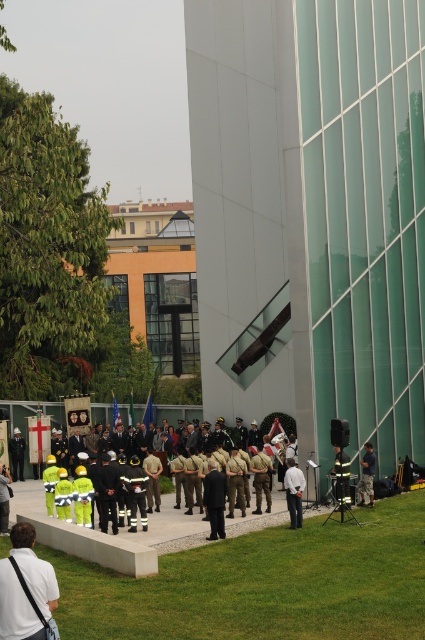
Question: Which point appears closest to the camera in this image?

Choices:
 (A) (346, 500)
 (B) (48, 612)

Answer: (B)

Question: Which object is closer to the camera taking this photo?

Choices:
 (A) white fabric uniform at lower left
 (B) reflective silver helmet at center

Answer: (A)

Question: Which of the following is the farthest from the observer?

Choices:
 (A) white fabric uniform at lower left
 (B) reflective silver helmet at center

Answer: (B)

Question: In this image, where is white fabric uniform at lower left located relative to reflective silver helmet at center?

Choices:
 (A) right
 (B) left

Answer: (B)

Question: Can you confirm if white fabric uniform at lower left is bigger than reflective silver helmet at center?

Choices:
 (A) no
 (B) yes

Answer: (A)

Question: Is white fabric uniform at lower left above reflective silver helmet at center?

Choices:
 (A) yes
 (B) no

Answer: (A)